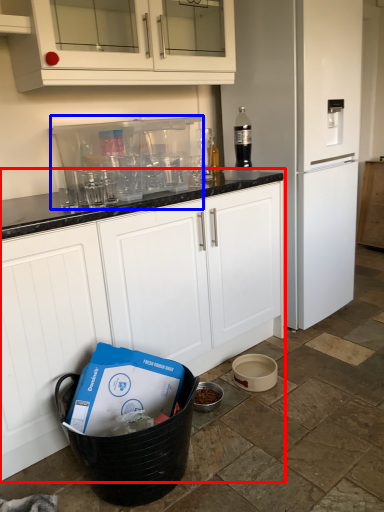
Question: Which object is further to the camera taking this photo, cabinetry (highlighted by a red box) or appliance (highlighted by a blue box)?

Choices:
 (A) cabinetry
 (B) appliance

Answer: (B)